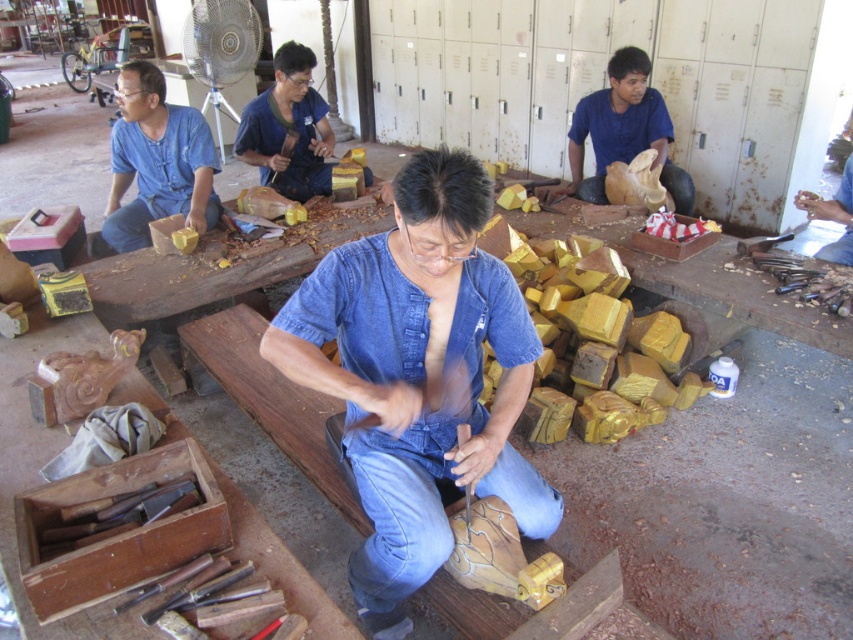
You are a photographer in the workshop and want to capture a closeup of the person working. Which clothing item, the matte blue shirt at center or the jeans at center, should you focus on to ensure it fills the frame more due to its size?

The matte blue shirt at center is larger in size than the jeans at center, so focusing on the matte blue shirt at center will fill the frame more.

You are a visitor in the workshop and want to compare the size of the objects. Which one is wider, the matte brown wood carving at upper right or the denim jeans at center?

The matte brown wood carving at upper right is wider than the denim jeans at center.

You are a visitor in the workshop and want to pick up the matte brown wood carving at upper right without touching the denim jeans at center. Is this possible?

The matte brown wood carving at upper right is positioned over denim jeans at center, so you can pick it up carefully without touching the denim jeans at center as long as you avoid the area where they overlap.